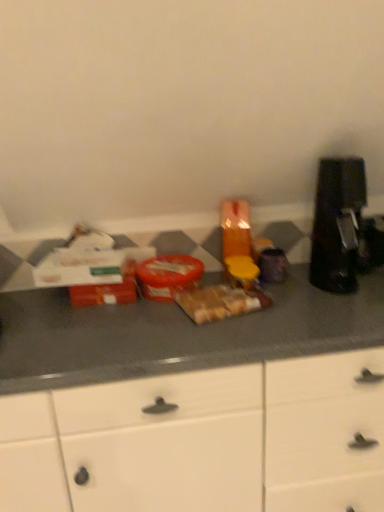
Identify the location of free location in front of brown matte sandwich at center, positioned as the 1th food in right-to-left order. This screenshot has width=384, height=512. (226, 331).